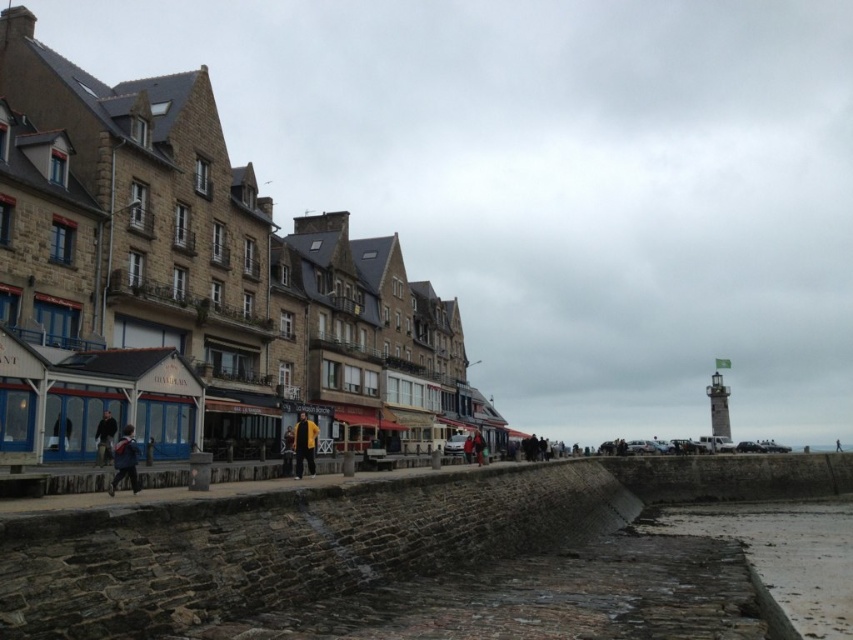
Can you confirm if yellow matte jacket at center is taller than dark blue jacket at center?

In fact, yellow matte jacket at center may be shorter than dark blue jacket at center.

Who is shorter, yellow matte jacket at center or dark blue jacket at center?

yellow matte jacket at center

Is point (309, 429) positioned before point (474, 436)?

Yes, it is in front of point (474, 436).

Find the location of `yellow matte jacket at center`. yellow matte jacket at center is located at coordinates (305, 444).

Does blue fabric jacket at lower left have a greater width compared to dark blue jacket at lower left?

Yes.

Identify the location of blue fabric jacket at lower left. (125, 460).

How far apart are dark blue jacket at lower left and red jacket at center?

They are 157.37 feet apart.

Between point (113, 422) and point (473, 454), which one is positioned in front?

Point (113, 422) is more forward.

This screenshot has width=853, height=640. What do you see at coordinates (103, 436) in the screenshot?
I see `dark blue jacket at lower left` at bounding box center [103, 436].

The width and height of the screenshot is (853, 640). I want to click on dark blue jacket at lower left, so click(103, 436).